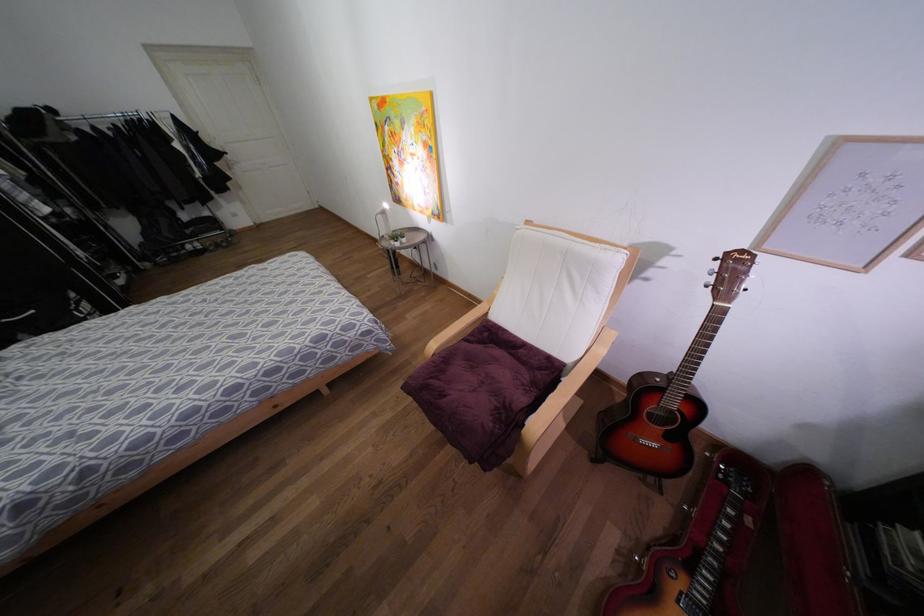
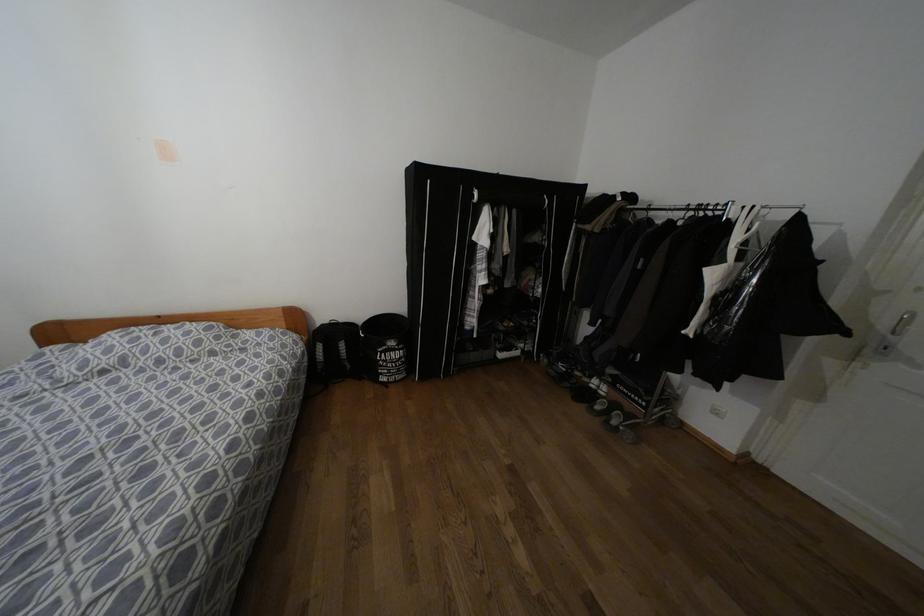
Where in the second image is the point corresponding to point 71,294 from the first image?

(391, 342)